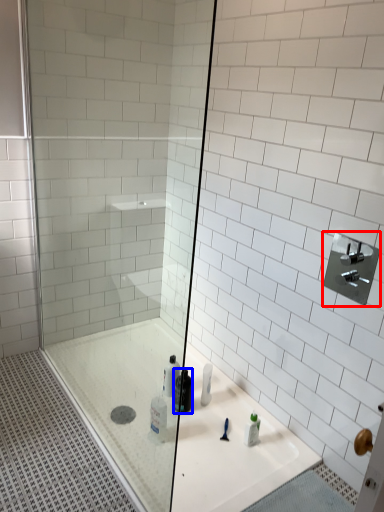
Question: Which object is further to the camera taking this photo, shower (highlighted by a red box) or mouthwash (highlighted by a blue box)?

Choices:
 (A) shower
 (B) mouthwash

Answer: (B)